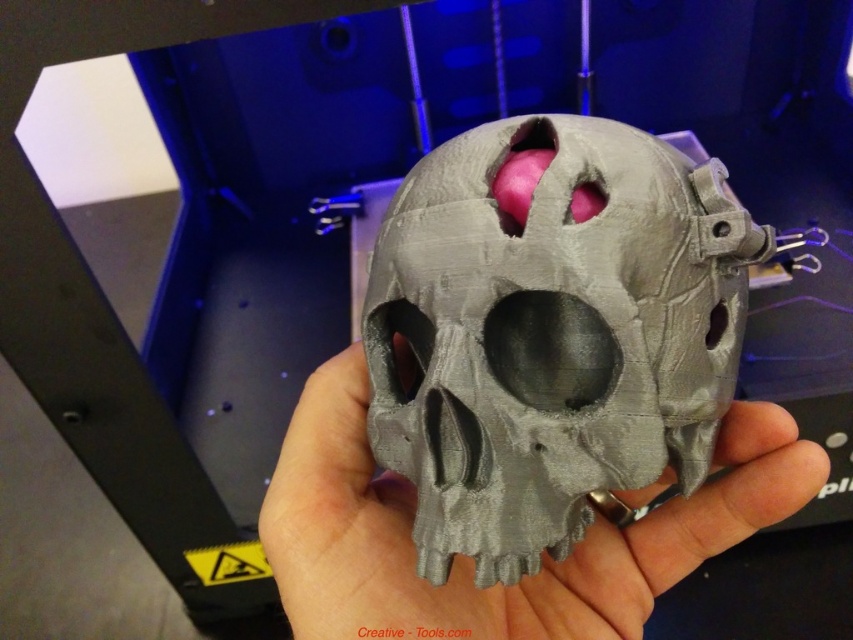
Question: Can you confirm if matte gray skull at center is thinner than gray matte skull at center?

Choices:
 (A) yes
 (B) no

Answer: (A)

Question: Can you confirm if matte gray skull at center is positioned to the left of gray matte skull at center?

Choices:
 (A) no
 (B) yes

Answer: (B)

Question: Which point is farther to the camera?

Choices:
 (A) (303, 403)
 (B) (412, 305)

Answer: (A)

Question: Which point is closer to the camera taking this photo?

Choices:
 (A) (689, 420)
 (B) (381, 518)

Answer: (A)

Question: Observing the image, what is the correct spatial positioning of matte gray skull at center in reference to gray matte skull at center?

Choices:
 (A) below
 (B) above

Answer: (B)